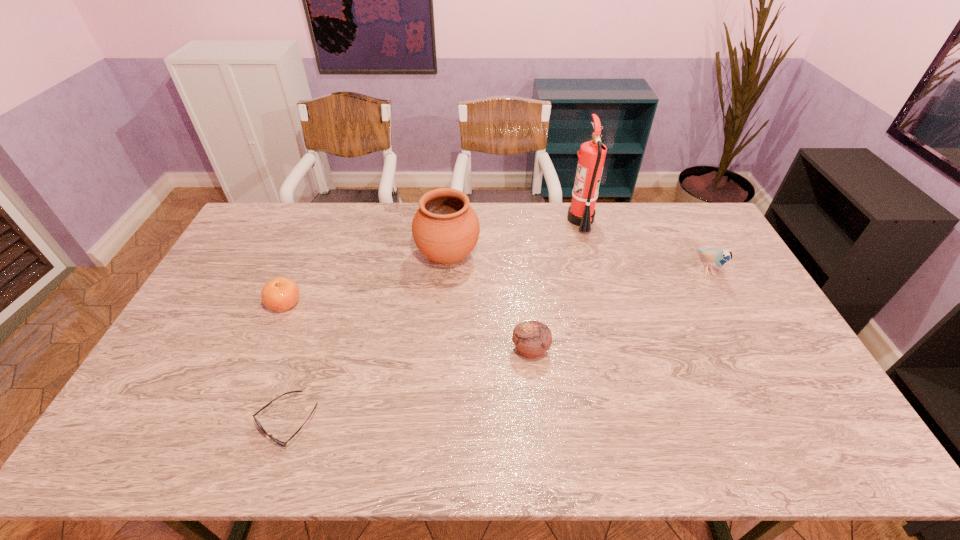
Select which object appears as the third closest to the sunglasses. Please provide its 2D coordinates. Your answer should be formatted as a tuple, i.e. [(x, y)], where the tuple contains the x and y coordinates of a point satisfying the conditions above.

[(532, 338)]

Find the location of `free region that satisfies the following two spatial constraints: 1. at the nozzle of the fire extinguisher; 2. on the front side of the second nearest object`. free region that satisfies the following two spatial constraints: 1. at the nozzle of the fire extinguisher; 2. on the front side of the second nearest object is located at coordinates (616, 350).